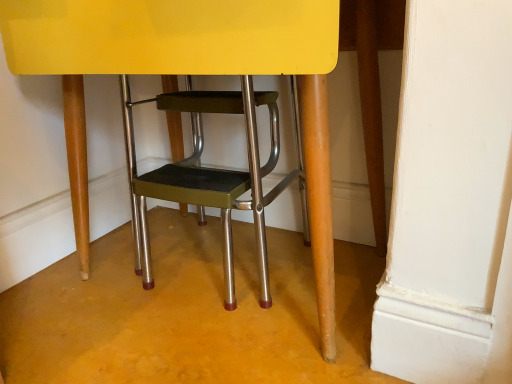
This screenshot has height=384, width=512. Find the location of `vacant area in front of metallic green stool at center`. vacant area in front of metallic green stool at center is located at coordinates (185, 351).